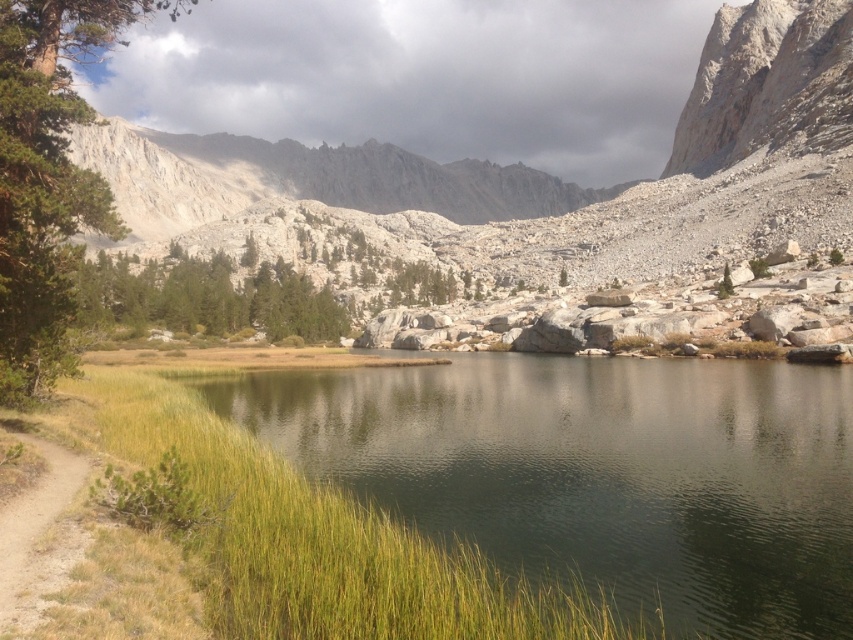
Between green textured tree at center and brown dirt path at lower left, which one is positioned higher?

green textured tree at center is above.

Does green textured tree at center have a greater width compared to brown dirt path at lower left?

Yes, green textured tree at center is wider than brown dirt path at lower left.

Between point (131, 304) and point (9, 602), which one is positioned behind?

The point (131, 304) is more distant.

I want to click on green textured tree at center, so click(206, 298).

Can you confirm if green leafy tree at left is wider than brown dirt path at lower left?

Yes.

In the scene shown: Which is more to the left, green leafy tree at left or brown dirt path at lower left?

Positioned to the left is green leafy tree at left.

Is point (62, 298) farther from viewer compared to point (70, 529)?

Yes.

Identify the location of green leafy tree at left. Image resolution: width=853 pixels, height=640 pixels. (48, 177).

Can you confirm if green leafy tree at left is thinner than green textured tree at center?

In fact, green leafy tree at left might be wider than green textured tree at center.

Is green leafy tree at left to the left of green textured tree at center from the viewer's perspective?

Yes, green leafy tree at left is to the left of green textured tree at center.

Find the location of a particular element. green leafy tree at left is located at coordinates (48, 177).